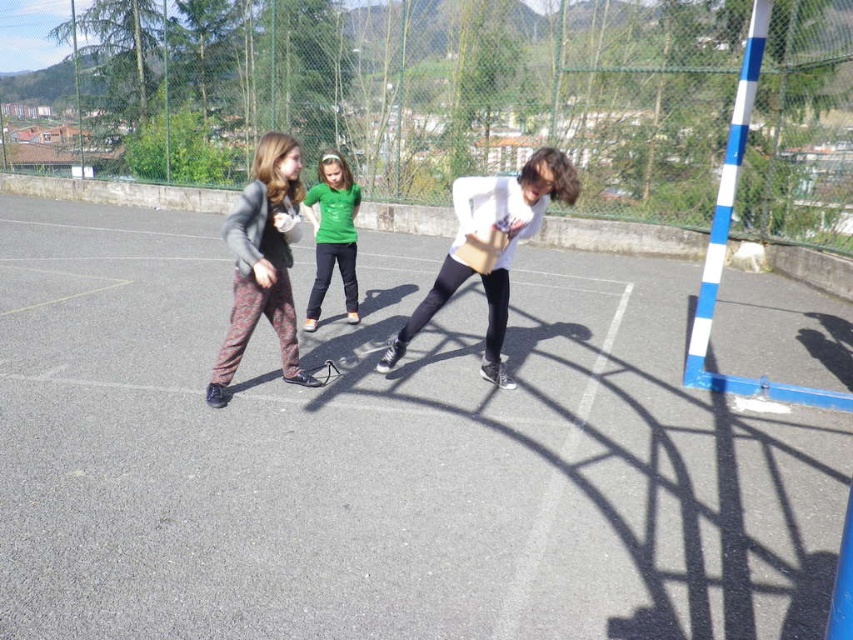
Which is in front, point (438, 289) or point (287, 305)?

Positioned in front is point (287, 305).

Who is more forward, (485, 253) or (236, 349)?

Point (236, 349)

At what (x,y) coordinates should I click in order to perform the action: click on white matte shirt at center. Please return your answer as a coordinate pair (x, y). The image size is (853, 640). Looking at the image, I should click on (490, 248).

Which is more to the left, smooth asphalt court at center or patterned fabric pants at center?

patterned fabric pants at center

Does smooth asphalt court at center have a larger size compared to patterned fabric pants at center?

Yes.

The height and width of the screenshot is (640, 853). In order to click on smooth asphalt court at center in this screenshot , I will do `click(386, 456)`.

Where is `smooth asphalt court at center`? smooth asphalt court at center is located at coordinates (386, 456).

Locate an element on the screen. smooth asphalt court at center is located at coordinates (386, 456).

Is smooth asphalt court at center taller than white matte shirt at center?

Yes, smooth asphalt court at center is taller than white matte shirt at center.

Between point (836, 365) and point (548, 186), which one is positioned in front?

Point (548, 186)

You are a GUI agent. You are given a task and a screenshot of the screen. Output one action in this format:
    pyautogui.click(x=<x>, y=<y>)
    Task: Click on the smooth asphalt court at center
    The height and width of the screenshot is (640, 853).
    Given the screenshot: What is the action you would take?
    pyautogui.click(x=386, y=456)